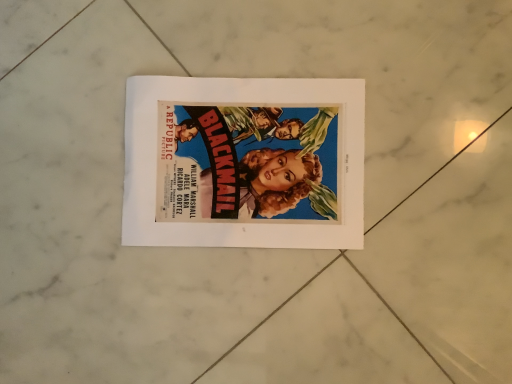
Where is `matte paper poster at center`? matte paper poster at center is located at coordinates (244, 162).

Based on the photo, what is the approximate width of matte paper poster at center?

matte paper poster at center is 12.05 inches wide.

What do you see at coordinates (244, 162) in the screenshot? This screenshot has width=512, height=384. I see `matte paper poster at center` at bounding box center [244, 162].

At what (x,y) coordinates should I click in order to perform the action: click on matte paper poster at center. Please return your answer as a coordinate pair (x, y). This screenshot has width=512, height=384. Looking at the image, I should click on (244, 162).